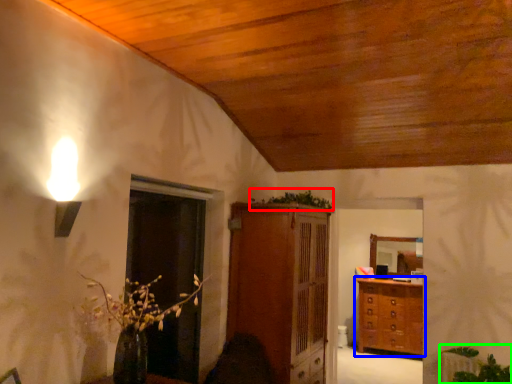
Question: Which object is positioned farthest from plant (highlighted by a red box)? Select from chest of drawers (highlighted by a blue box) and plant (highlighted by a green box).

Choices:
 (A) chest of drawers
 (B) plant

Answer: (B)